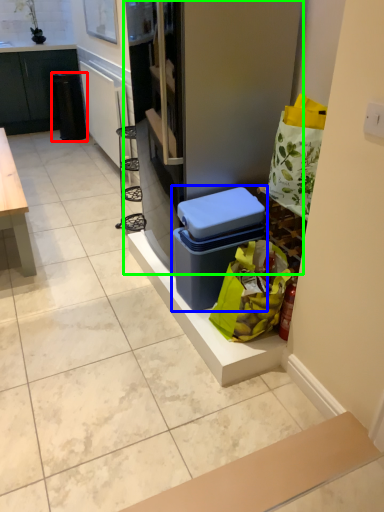
Question: Considering the real-world distances, which object is farthest from trash bin/can (highlighted by a red box)? storage box (highlighted by a blue box) or fridge (highlighted by a green box)?

Choices:
 (A) storage box
 (B) fridge

Answer: (A)